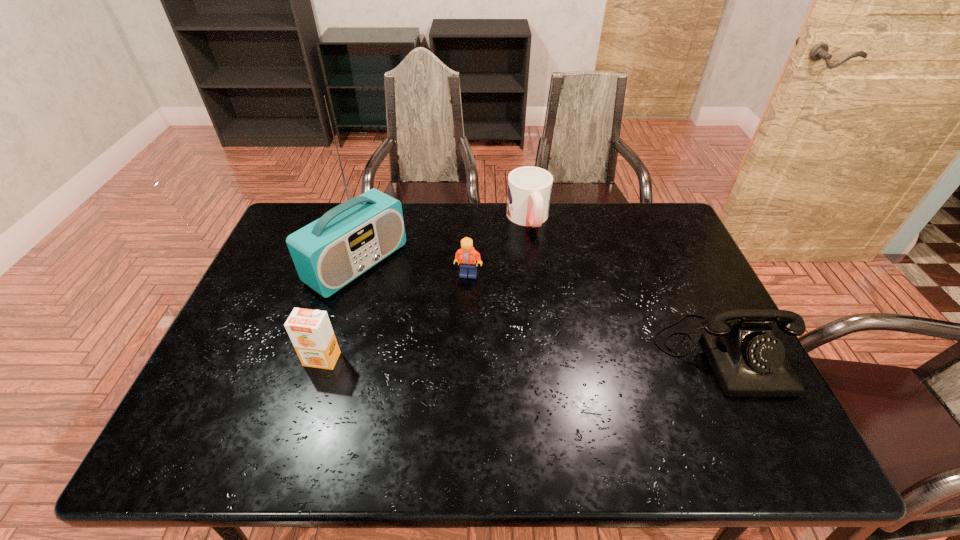
The image size is (960, 540). In order to click on vacant area between the fourth object from left to right and the third object from right to left in this screenshot , I will do `click(498, 247)`.

Identify the location of vacant space that's between the orange juice and the mug. (425, 289).

Where is `vacant area that lies between the third object from right to left and the second object from right to left`? vacant area that lies between the third object from right to left and the second object from right to left is located at coordinates (498, 247).

Find the location of a particular element. The image size is (960, 540). unoccupied area between the orange juice and the third object from left to right is located at coordinates (396, 317).

This screenshot has height=540, width=960. What are the coordinates of `vacant space in between the orange juice and the Lego` in the screenshot? It's located at (396, 317).

Where is `free spot between the telephone and the third object from left to right`? The image size is (960, 540). free spot between the telephone and the third object from left to right is located at coordinates (596, 314).

Identify the location of free spot between the fourth object from left to right and the telephone. The height and width of the screenshot is (540, 960). (626, 286).

Locate which object ranks third in proximity to the second object from right to left. Please provide its 2D coordinates. Your answer should be formatted as a tuple, i.e. [(x, y)], where the tuple contains the x and y coordinates of a point satisfying the conditions above.

[(748, 361)]

Locate an element on the screen. The width and height of the screenshot is (960, 540). object that is the fourth closest one to the mug is located at coordinates (311, 333).